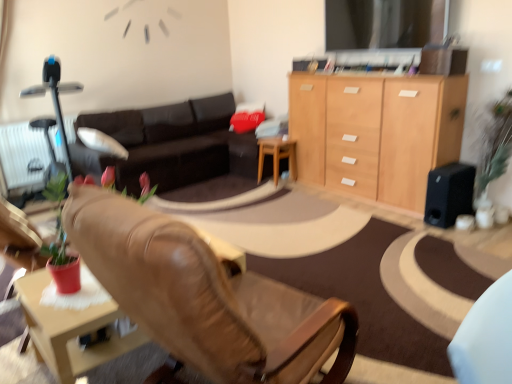
Question: Relative to white textured radiator at left, is dark brown leather couch at center in front or behind?

Choices:
 (A) behind
 (B) front

Answer: (B)

Question: Considering the relative positions of dark brown leather couch at center and white textured radiator at left in the image provided, is dark brown leather couch at center to the left or to the right of white textured radiator at left?

Choices:
 (A) right
 (B) left

Answer: (A)

Question: Estimate the real-world distances between objects in this image. Which object is farther from the white textured radiator at left?

Choices:
 (A) black matte speaker at right
 (B) dark brown leather couch at center
 (C) light wood cabinet at upper right
 (D) wooden at center
 (E) leather chair at center

Answer: (A)

Question: Which is nearer to the wooden at center?

Choices:
 (A) light wood cabinet at upper right
 (B) white textured radiator at left
 (C) leather chair at center
 (D) dark brown leather couch at center
 (E) black matte speaker at right

Answer: (D)